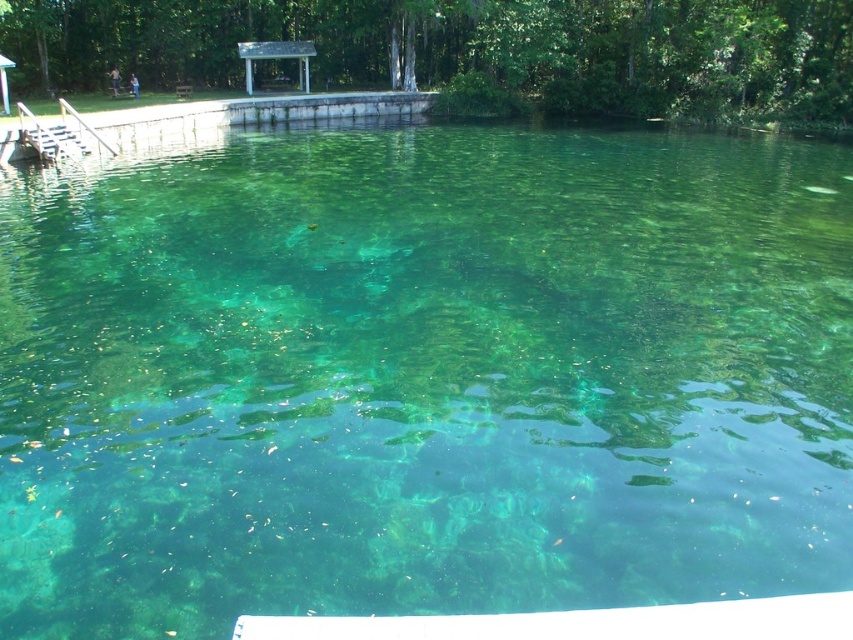
You are planning to bring a 2.5 meter wide inflatable raft to the wooden dock at left and the white wooden gazebo at upper center. Which location can accommodate the raft without requiring any modifications?

The white wooden gazebo at upper center can accommodate the 2.5 meter wide inflatable raft since its width is greater than the wooden dock at left.

You are standing on the wooden dock at left and want to reach the white wooden gazebo at upper center. Which direction should you move to get there?

The wooden dock at left is below the white wooden gazebo at upper center, so you should move upward to reach it.